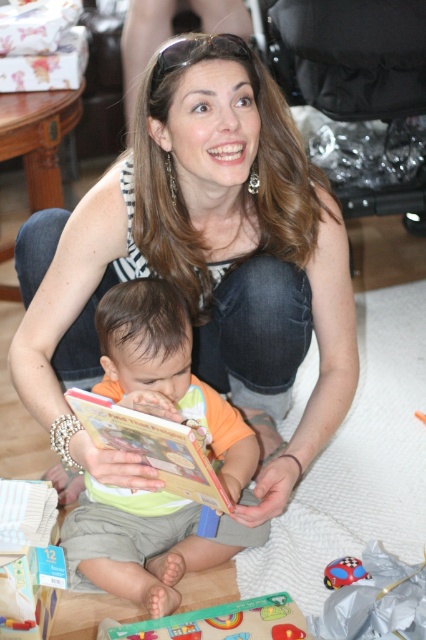
This screenshot has width=426, height=640. Find the location of `hardcover book at center`. hardcover book at center is located at coordinates coord(149,445).

Is hardcover book at center wider than plastic red car at center?

Yes, hardcover book at center is wider than plastic red car at center.

What do you see at coordinates (149, 445) in the screenshot?
I see `hardcover book at center` at bounding box center [149, 445].

I want to click on hardcover book at center, so click(149, 445).

Does hardcover book at center come behind green matte puzzle piece at lower center?

No, hardcover book at center is closer to the viewer.

Who is more distant from viewer, (166, 468) or (111, 634)?

The point (166, 468) is more distant.

The height and width of the screenshot is (640, 426). What do you see at coordinates (149, 445) in the screenshot?
I see `hardcover book at center` at bounding box center [149, 445].

Locate an element on the screen. The image size is (426, 640). hardcover book at center is located at coordinates (149, 445).

In the scene shown: Is matte black tank top at upper center shorter than hardcover book at center?

In fact, matte black tank top at upper center may be taller than hardcover book at center.

Does matte black tank top at upper center have a larger size compared to hardcover book at center?

Yes, matte black tank top at upper center is bigger than hardcover book at center.

Does point (307, 189) come farther from viewer compared to point (178, 433)?

Yes, point (307, 189) is farther from viewer.

This screenshot has width=426, height=640. I want to click on matte black tank top at upper center, so click(x=207, y=236).